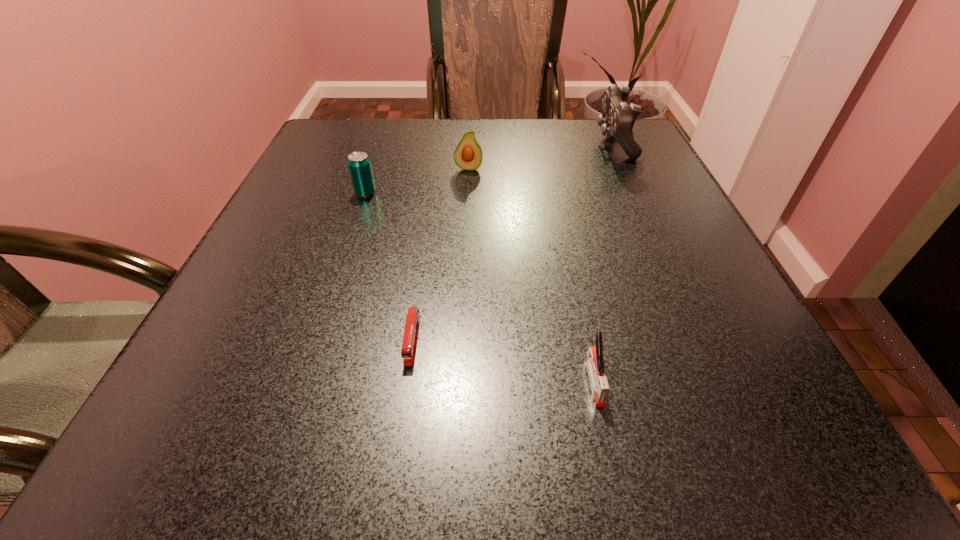
This screenshot has width=960, height=540. I want to click on object that is at the far right corner, so click(x=618, y=119).

Identify the location of vacant space at the far edge. (414, 150).

This screenshot has height=540, width=960. I want to click on vacant region at the near edge of the desktop, so click(x=305, y=469).

In the image, there is a desktop. Where is `free space at the left edge`? This screenshot has width=960, height=540. free space at the left edge is located at coordinates (246, 255).

In the image, there is a desktop. At what (x,y) coordinates should I click in order to perform the action: click on vacant space at the right edge. Please return your answer as a coordinate pair (x, y). Looking at the image, I should click on (666, 178).

Where is `vacant space at the far left corner of the desktop`? Image resolution: width=960 pixels, height=540 pixels. vacant space at the far left corner of the desktop is located at coordinates (374, 123).

In the image, there is a desktop. At what (x,y) coordinates should I click in order to perform the action: click on free space at the far right corner. Please return your answer as a coordinate pair (x, y). Looking at the image, I should click on (615, 147).

The width and height of the screenshot is (960, 540). I want to click on vacant space at the near right corner, so click(x=754, y=422).

At what (x,y) coordinates should I click in order to perform the action: click on empty location between the farthest object and the fourth object from left to right. Please return your answer as a coordinate pair (x, y). The height and width of the screenshot is (540, 960). Looking at the image, I should click on (604, 261).

This screenshot has width=960, height=540. In order to click on vacant space that is in between the shortest object and the taller stapler in this screenshot , I will do `click(503, 360)`.